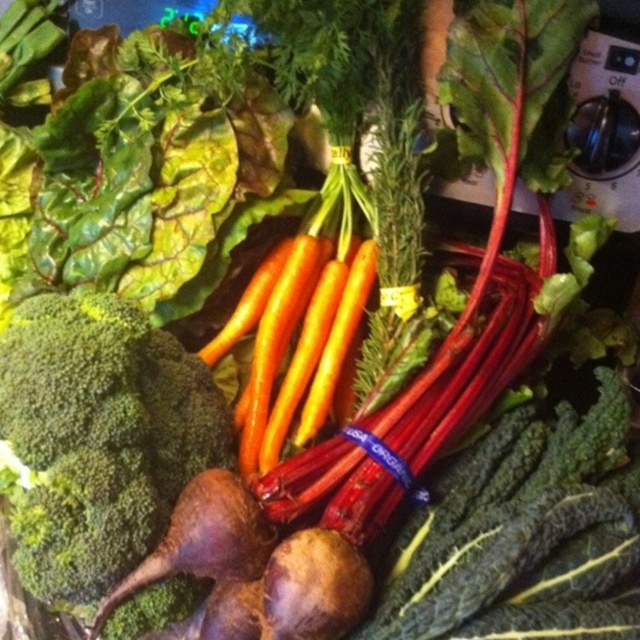
You are arranging vegetables for a salad and see the green matte broccoli at lower left and the orange smooth carrot at center. Which vegetable is located to the left of the other?

The green matte broccoli at lower left is positioned on the left side of orange smooth carrot at center.

You are setting up a vegetable display and need to arrange the green matte broccoli at lower left and orange smooth carrot at center. If you want to place them side by side, which vegetable should you position first to ensure they fit on the shelf?

The green matte broccoli at lower left might be wider than orange smooth carrot at center, so you should position the broccoli first to account for its potential width.

You are a chef preparing a vegetable platter and need to arrange the green matte broccoli at lower left and orange smooth carrot at center. Which vegetable should you place first if you want to start with the larger one?

The green matte broccoli at lower left is bigger than the orange smooth carrot at center, so you should place the green matte broccoli at lower left first.